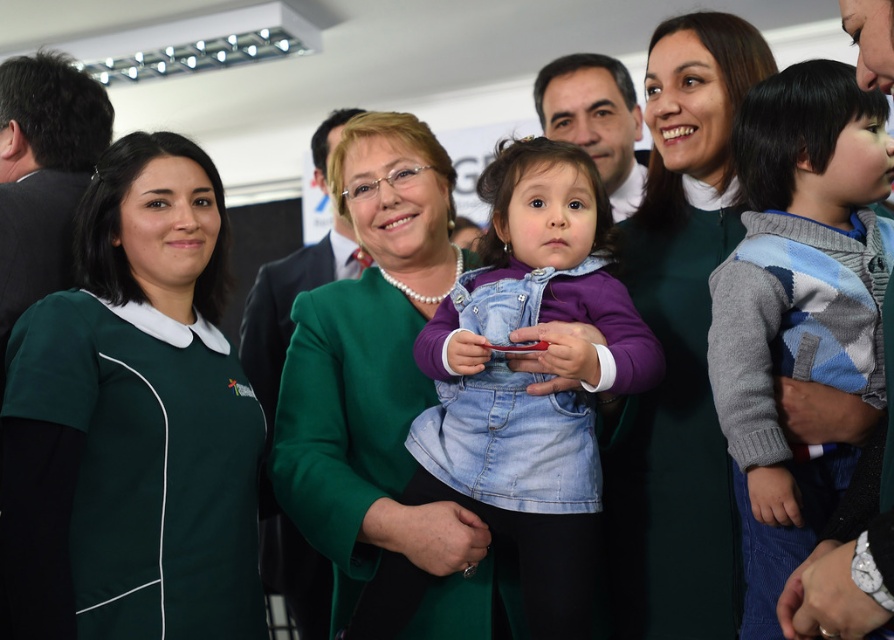
Question: Which of the following is the closest to the observer?

Choices:
 (A) green fabric shirt at left
 (B) green satin jacket at center

Answer: (A)

Question: Which point is farther from the camera taking this photo?

Choices:
 (A) (62, 323)
 (B) (503, 305)
 (C) (351, 292)

Answer: (C)

Question: Can you confirm if green satin jacket at center is positioned to the right of green dress at center?

Choices:
 (A) yes
 (B) no

Answer: (B)

Question: Which point is closer to the camera?

Choices:
 (A) green fabric shirt at left
 (B) denim overalls at center
 (C) argyle sweater at center
 (D) green satin jacket at center

Answer: (A)

Question: Is argyle sweater at center positioned at the back of green satin jacket at center?

Choices:
 (A) no
 (B) yes

Answer: (A)

Question: Where is denim overalls at center located in relation to green satin jacket at center in the image?

Choices:
 (A) left
 (B) right

Answer: (B)